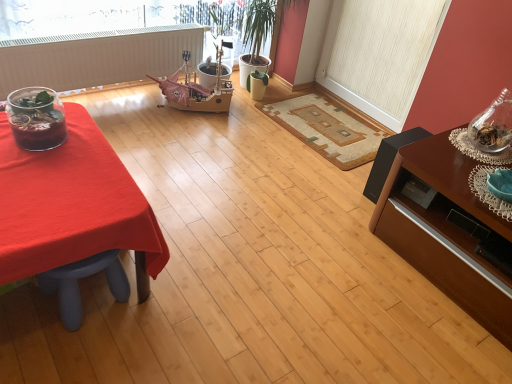
Where is `vacant space in between smooth red tablecloth at left and beige woven mat at center`? The height and width of the screenshot is (384, 512). vacant space in between smooth red tablecloth at left and beige woven mat at center is located at coordinates (234, 172).